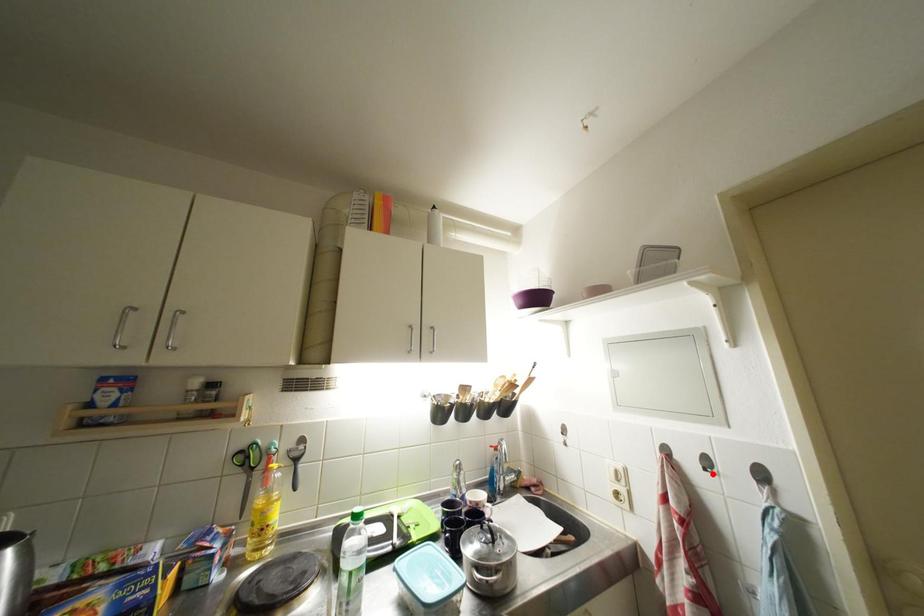
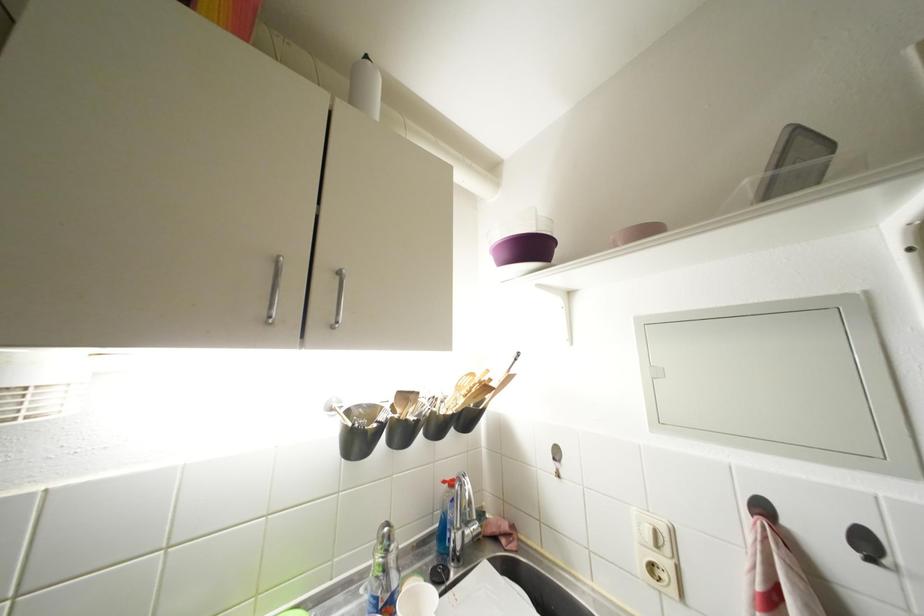
The point at the highlighted location is marked in the first image. Where is the corresponding point in the second image?

(877, 565)